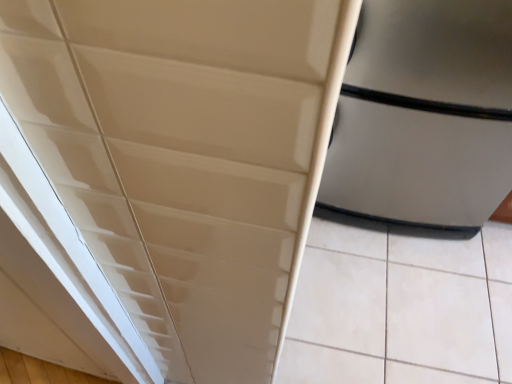
The width and height of the screenshot is (512, 384). I want to click on free space in front of satin silver refrigerator at right, so click(x=402, y=298).